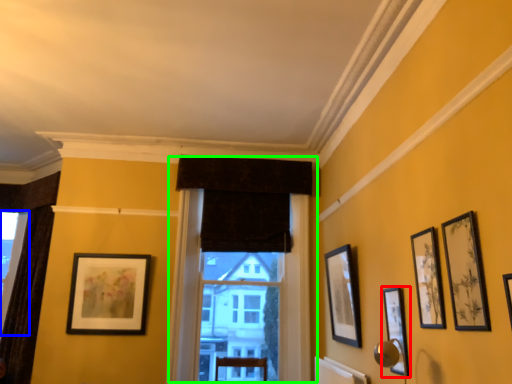
Question: Considering the real-world distances, which object is farthest from picture frame (highlighted by a red box)? window (highlighted by a blue box) or window (highlighted by a green box)?

Choices:
 (A) window
 (B) window

Answer: (A)